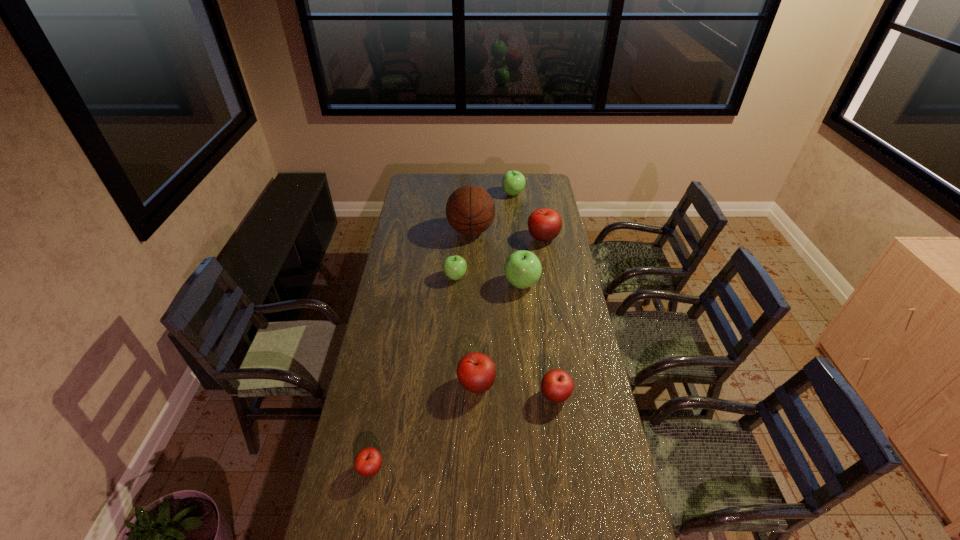
Where is `object that is at the far edge`? The width and height of the screenshot is (960, 540). object that is at the far edge is located at coordinates (513, 182).

The width and height of the screenshot is (960, 540). What are the coordinates of `object located at the left edge` in the screenshot? It's located at (368, 461).

In the image, there is a desktop. Identify the location of free space at the far edge. (487, 190).

Identify the location of free space at the left edge of the desktop. The height and width of the screenshot is (540, 960). (382, 342).

Locate an element on the screen. Image resolution: width=960 pixels, height=540 pixels. blank area at the right edge is located at coordinates (567, 453).

You are a GUI agent. You are given a task and a screenshot of the screen. Output one action in this format:
    pyautogui.click(x=<x>, y=<y>)
    Task: Click on the free spot at the far left corner of the desktop
    This screenshot has height=540, width=960.
    Given the screenshot: What is the action you would take?
    tap(406, 190)

In the image, there is a desktop. Where is `free space at the far right corner`? The width and height of the screenshot is (960, 540). free space at the far right corner is located at coordinates (537, 185).

Identify the location of free space between the nearest apple and the second smallest red apple. (463, 432).

Locate an element on the screen. The height and width of the screenshot is (540, 960). free space between the third smallest red apple and the leftmost green apple is located at coordinates (466, 330).

You are a GUI agent. You are given a task and a screenshot of the screen. Output one action in this format:
    pyautogui.click(x=<x>, y=<y>)
    Task: Click on the vacant point located between the second biggest green apple and the second biggest red apple
    Image resolution: width=960 pixels, height=540 pixels.
    Given the screenshot: What is the action you would take?
    pyautogui.click(x=494, y=289)